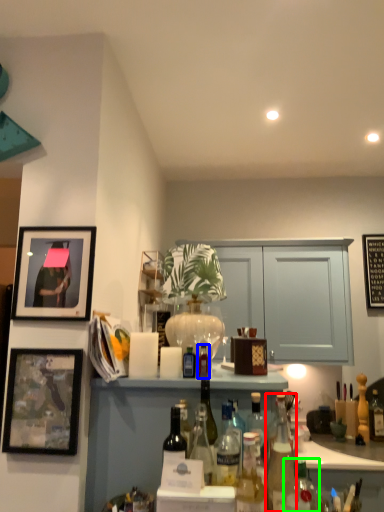
Question: Which object is the farthest from bottle (highlighted by a red box)? Choose among these: bottle (highlighted by a blue box) or bottle (highlighted by a green box).

Choices:
 (A) bottle
 (B) bottle

Answer: (A)